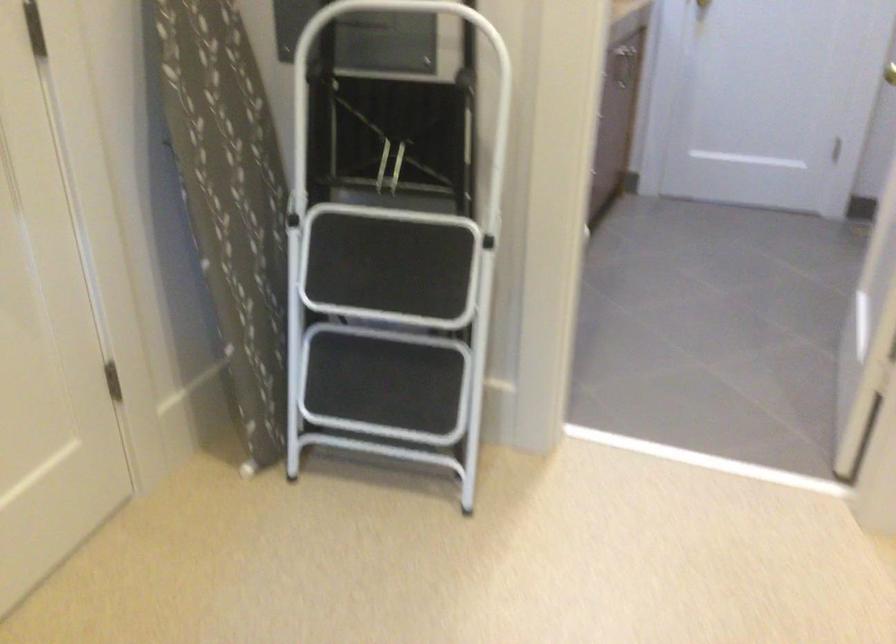
Find where to lift the patterned ironing board. Please return your answer as a coordinate pair (x, y).

(229, 199)